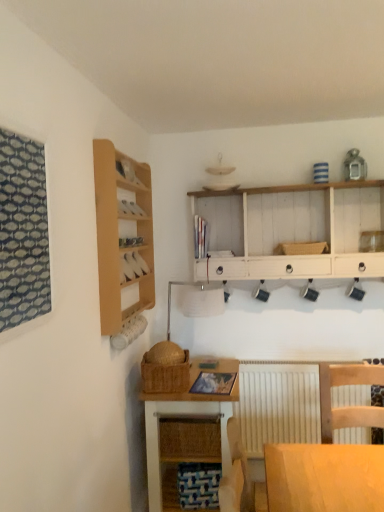
What do you see at coordinates (186, 430) in the screenshot? The image size is (384, 512). I see `woven wood desk at lower center` at bounding box center [186, 430].

The image size is (384, 512). What are the coordinates of `white painted wood shelf at upper center` in the screenshot? It's located at (291, 230).

This screenshot has height=512, width=384. Describe the element at coordinates (23, 231) in the screenshot. I see `patterned fabric window at left` at that location.

The height and width of the screenshot is (512, 384). Identify the location of woven straw basket at center, positioned as the second basket in bottom-to-top order. (303, 248).

In order to face wooden cabinet at upper left, should I rotate leftwards or rightwards?

It's best to rotate left around 8.025 degrees.

Locate an element on the screen. woven wood desk at lower center is located at coordinates (186, 430).

Do you think woven straw basket at center, which appears as the 2th basket when viewed from the left, is within white matte radiator at lower center, or outside of it?

woven straw basket at center, which appears as the 2th basket when viewed from the left, is outside white matte radiator at lower center.

Based on the photo, can you confirm if woven straw basket at center, which is the 1th basket in back-to-front order, is positioned to the left of white matte radiator at lower center?

No.

Where is `the 1st basket in front of the white matte radiator at lower center`? This screenshot has height=512, width=384. the 1st basket in front of the white matte radiator at lower center is located at coordinates (303, 248).

From a real-world perspective, is woven straw basket at center, which is the 1th basket from top to bottom, located beneath white matte radiator at lower center?

No, from a real-world perspective, woven straw basket at center, which is the 1th basket from top to bottom, is not under white matte radiator at lower center.

In the image, is white painted wood shelf at upper center positioned in front of or behind woven brown basket at lower center, which is the 1th basket from left to right?

white painted wood shelf at upper center is positioned farther from the viewer than woven brown basket at lower center, which is the 1th basket from left to right.

Can you tell me how much white painted wood shelf at upper center and woven brown basket at lower center, the 2th basket when ordered from back to front, differ in facing direction?

They differ by 91.6 degrees in their facing directions.

Is white painted wood shelf at upper center inside the boundaries of woven brown basket at lower center, marked as the 2th basket in a right-to-left arrangement, or outside?

white painted wood shelf at upper center cannot be found inside woven brown basket at lower center, marked as the 2th basket in a right-to-left arrangement.

Which is behind, point (314, 201) or point (185, 360)?

The point (314, 201) is behind.

Is woven wood desk at lower center to the left of patterned fabric window at left from the viewer's perspective?

Incorrect, woven wood desk at lower center is not on the left side of patterned fabric window at left.

Is woven wood desk at lower center wider than patterned fabric window at left?

Yes, woven wood desk at lower center is wider than patterned fabric window at left.

Does woven wood desk at lower center have a greater height compared to patterned fabric window at left?

Yes.

Which object is closer to the camera, light wood shelf at left or woven brown basket at lower center, marked as the 1th basket in a front-to-back arrangement?

light wood shelf at left.

From the image's perspective, which is above, light wood shelf at left or woven brown basket at lower center, which is the 1th basket from left to right?

light wood shelf at left.

Is light wood shelf at left outside of woven brown basket at lower center, which is the 1th basket from left to right?

Indeed, light wood shelf at left is completely outside woven brown basket at lower center, which is the 1th basket from left to right.

Between patterned fabric window at left and white matte radiator at lower center, which one is positioned in front?

patterned fabric window at left.

Could you tell me if patterned fabric window at left is facing white matte radiator at lower center?

No, patterned fabric window at left is not aimed at white matte radiator at lower center.

From the image's perspective, is patterned fabric window at left located above or below white matte radiator at lower center?

Based on their image positions, patterned fabric window at left is located above white matte radiator at lower center.

Is point (32, 226) closer or farther from the camera than point (250, 411)?

Point (32, 226) is closer to the camera than point (250, 411).

Is white matte radiator at lower center bigger or smaller than woven brown basket at lower center, the 2th basket when ordered from back to front?

Clearly, white matte radiator at lower center is larger in size than woven brown basket at lower center, the 2th basket when ordered from back to front.

Could you tell me if white matte radiator at lower center is turned towards woven brown basket at lower center, the 2th basket when ordered from back to front?

No, white matte radiator at lower center is not turned towards woven brown basket at lower center, the 2th basket when ordered from back to front.

From the picture: From the image's perspective, which one is positioned lower, white matte radiator at lower center or woven brown basket at lower center, the 1th basket ordered from the bottom?

white matte radiator at lower center, from the image's perspective.

Considering the relative positions of white matte radiator at lower center and woven brown basket at lower center, marked as the 1th basket in a front-to-back arrangement, in the image provided, is white matte radiator at lower center to the left of woven brown basket at lower center, marked as the 1th basket in a front-to-back arrangement, from the viewer's perspective?

No, white matte radiator at lower center is not to the left of woven brown basket at lower center, marked as the 1th basket in a front-to-back arrangement.

Is point (97, 238) less distant than point (369, 442)?

Yes, it is.

Is light wood shelf at left far from white matte radiator at lower center?

Indeed, light wood shelf at left is not near white matte radiator at lower center.

Is white matte radiator at lower center at the back of light wood shelf at left?

No, light wood shelf at left's orientation is not away from white matte radiator at lower center.

There is a white matte radiator at lower center. Where is `the 2nd basket above it (from the image's perspective)`? the 2nd basket above it (from the image's perspective) is located at coordinates (303, 248).

Identify the location of basket that is the 2nd one below the white painted wood shelf at upper center (from a real-world perspective). This screenshot has height=512, width=384. (166, 376).

Which object lies nearer to the anchor point white painted wood shelf at upper center, woven straw basket at center, the 2th basket viewed from the front, or woven brown basket at lower center, which is counted as the 2th basket, starting from the top?

woven straw basket at center, the 2th basket viewed from the front, lies closer to white painted wood shelf at upper center than the other object.

Which object lies further to the anchor point woven wood desk at lower center, woven brown basket at lower center, the 1th basket ordered from the bottom, or wooden chair at lower right?

wooden chair at lower right.

Based on their spatial positions, is light wood shelf at left or woven straw basket at center, which is the 1th basket in back-to-front order, further from woven brown basket at lower center, marked as the 2th basket in a right-to-left arrangement?

Among the two, woven straw basket at center, which is the 1th basket in back-to-front order, is located further to woven brown basket at lower center, marked as the 2th basket in a right-to-left arrangement.

Based on their spatial positions, is patterned fabric window at left or wooden cabinet at upper left further from woven straw basket at center, which is the 1th basket in back-to-front order?

Based on the image, patterned fabric window at left appears to be further to woven straw basket at center, which is the 1th basket in back-to-front order.

Looking at the image, which one is located closer to woven straw basket at center, the 2th basket viewed from the front, wooden chair at lower right or patterned fabric window at left?

Among the two, wooden chair at lower right is located nearer to woven straw basket at center, the 2th basket viewed from the front.

Considering their positions, is white matte radiator at lower center positioned further to woven brown basket at lower center, the 2th basket when ordered from back to front, than light wood shelf at left?

white matte radiator at lower center.

From the image, which object appears to be nearer to wooden cabinet at upper left, light wood shelf at left or white painted wood shelf at upper center?

light wood shelf at left is positioned closer to the anchor wooden cabinet at upper left.

Which object lies further to the anchor point wooden cabinet at upper left, light wood shelf at left or woven wood desk at lower center?

woven wood desk at lower center is positioned further to the anchor wooden cabinet at upper left.

At what (x,y) coordinates should I click in order to perform the action: click on cabinet between light wood shelf at left and white matte radiator at lower center in the up-down direction. Please return your answer as a coordinate pair (x, y). The width and height of the screenshot is (384, 512). Looking at the image, I should click on (x=132, y=266).

Locate an element on the screen. Image resolution: width=384 pixels, height=512 pixels. desk between patterned fabric window at left and woven straw basket at center, which appears as the 2th basket when viewed from the left, from front to back is located at coordinates (186, 430).

In order to click on shelf between patterned fabric window at left and white painted wood shelf at upper center in the front-back direction in this screenshot , I will do [123, 234].

Identify the location of basket between patterned fabric window at left and white painted wood shelf at upper center from front to back. The width and height of the screenshot is (384, 512). (x=166, y=376).